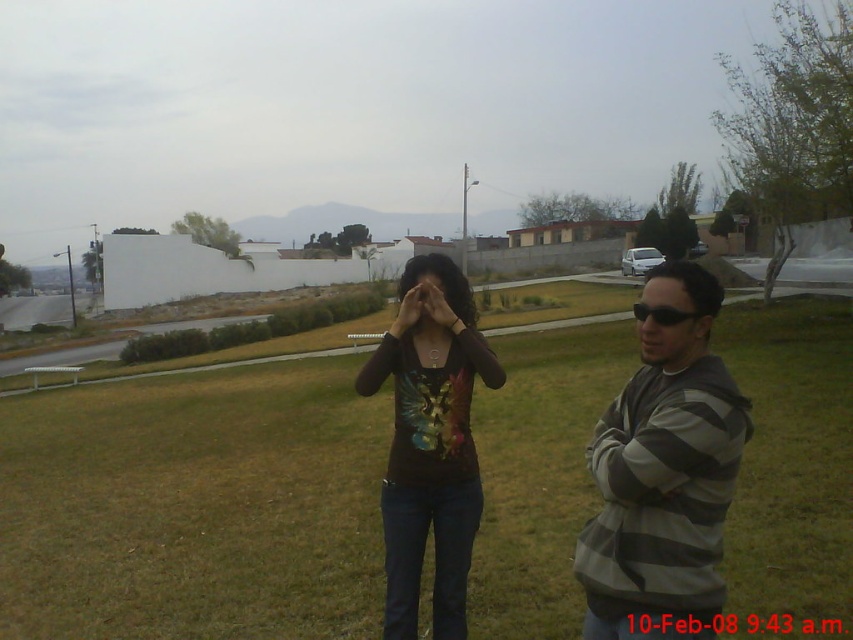
Who is more forward, (67, 433) or (383, 342)?

Positioned in front is point (383, 342).

Can you confirm if green grass at center is smaller than shiny multicolored shirt at center?

No, green grass at center is not smaller than shiny multicolored shirt at center.

Where is `green grass at center`? Image resolution: width=853 pixels, height=640 pixels. green grass at center is located at coordinates (194, 508).

Does green grass at center have a lesser height compared to gray striped sweater at right?

Incorrect, green grass at center's height does not fall short of gray striped sweater at right's.

In the scene shown: Is green grass at center closer to camera compared to gray striped sweater at right?

No, green grass at center is behind gray striped sweater at right.

Identify the location of green grass at center. Image resolution: width=853 pixels, height=640 pixels. (194, 508).

Can you confirm if green grass at center is taller than matte brown shirt at center?

Yes, green grass at center is taller than matte brown shirt at center.

The height and width of the screenshot is (640, 853). What do you see at coordinates (194, 508) in the screenshot?
I see `green grass at center` at bounding box center [194, 508].

At what (x,y) coordinates should I click in order to perform the action: click on green grass at center. Please return your answer as a coordinate pair (x, y). The image size is (853, 640). Looking at the image, I should click on (194, 508).